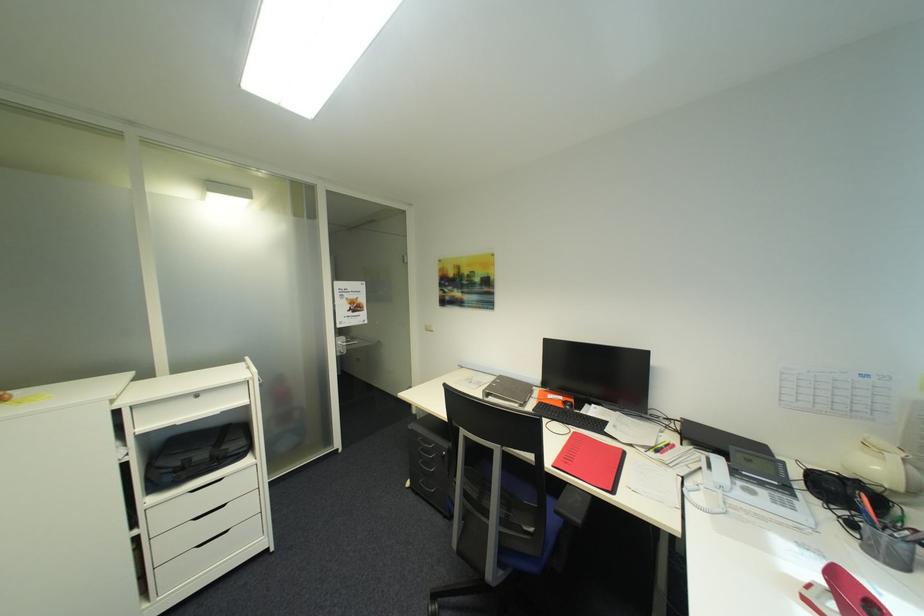
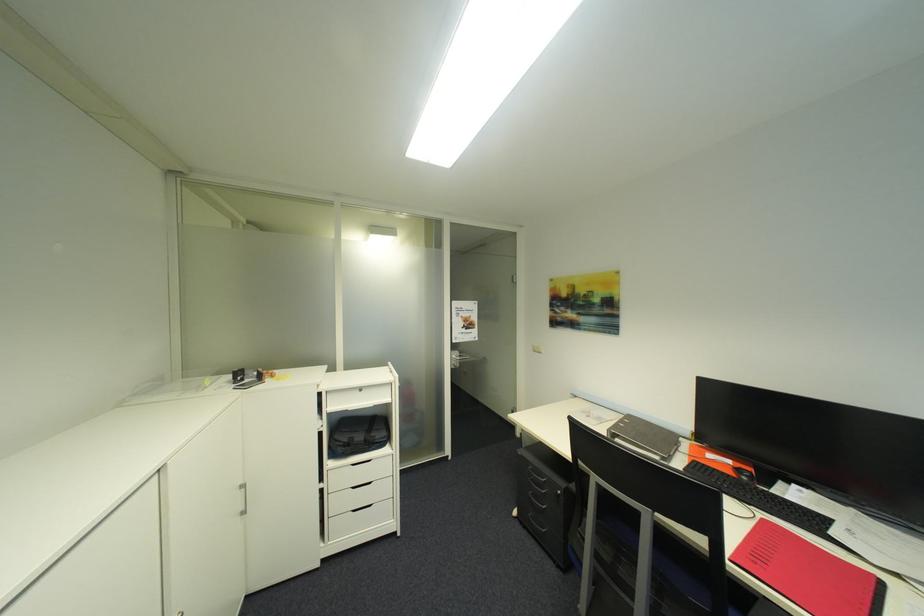
Locate, in the second image, the point that corresponds to [576,437] in the first image.

(760, 524)